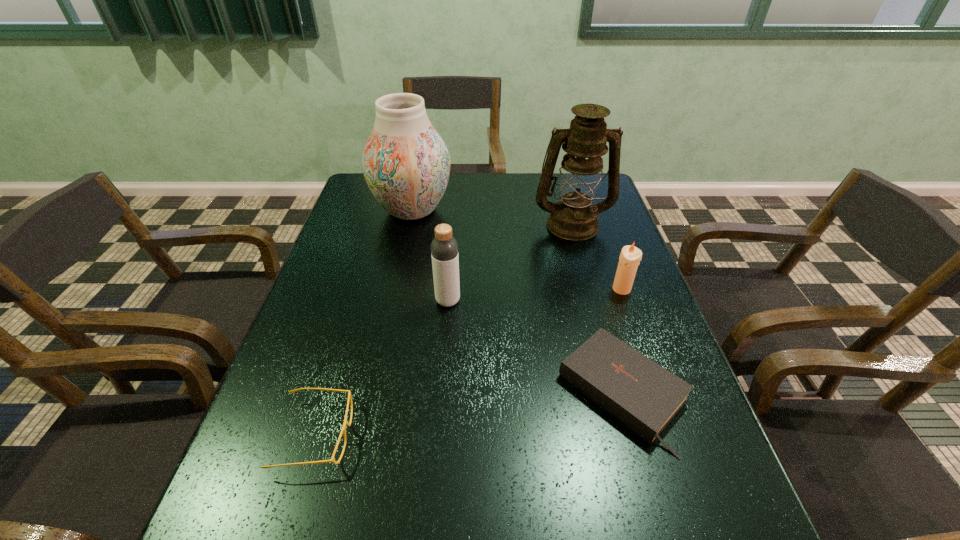
Identify the location of vacant region located 0.110m in front of the lenses of the spectacles. (408, 435).

I want to click on vacant space located on the left of the Bible, so click(x=527, y=393).

Locate an element on the screen. The height and width of the screenshot is (540, 960). object present at the far edge is located at coordinates (406, 164).

Where is `vase that is at the left edge`? The height and width of the screenshot is (540, 960). vase that is at the left edge is located at coordinates (406, 164).

Identify the location of spectacles present at the left edge. (343, 430).

Where is `oil lamp present at the right edge`? The height and width of the screenshot is (540, 960). oil lamp present at the right edge is located at coordinates (574, 218).

Where is `candle positioned at the right edge`? This screenshot has height=540, width=960. candle positioned at the right edge is located at coordinates (630, 256).

At what (x,y) coordinates should I click in order to perform the action: click on Bible situated at the right edge. Please return your answer as a coordinate pair (x, y). The height and width of the screenshot is (540, 960). Looking at the image, I should click on (644, 396).

I want to click on object that is at the far left corner, so click(x=406, y=164).

Image resolution: width=960 pixels, height=540 pixels. Identify the location of free spot at the far edge of the desktop. (498, 188).